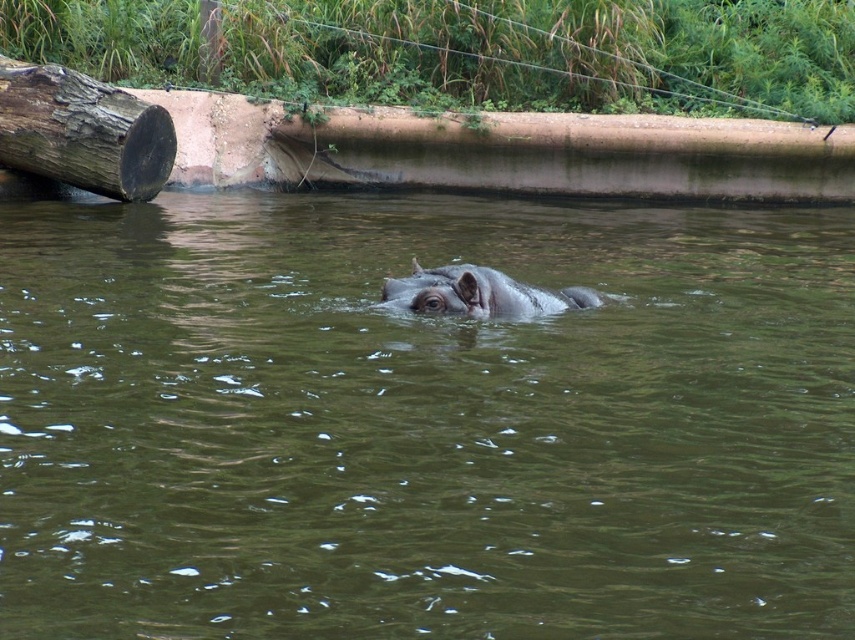
You are a wildlife photographer standing at the camera position. You want to take a photo of the hippopotamus but need to avoid the dark brown rough log at left blocking your view. Is the log between you and the hippo?

The dark brown rough log at left is 13.43 meters away from the camera. Since the hippo is partially submerged in the water and the log is positioned at the left side of the frame, the log is not between the camera and the hippo. Therefore, the log won not block your view of the hippo.

You are standing at the point marked as point (422, 422) in the image. What do you see directly in front of you?

You see the brown murky water at center directly in front of you at point (422, 422).

You are a wildlife photographer aiming to capture the hippopotamus in the scene. You need to position your camera so that the dark brown rough log at left is visible in the background behind the brown murky water at center. Is this possible given their positions?

The brown murky water at center is located below the dark brown rough log at left, so yes, positioning the camera so that the dark brown rough log at left appears behind the brown murky water at center is possible because the log is above the water in the frame.